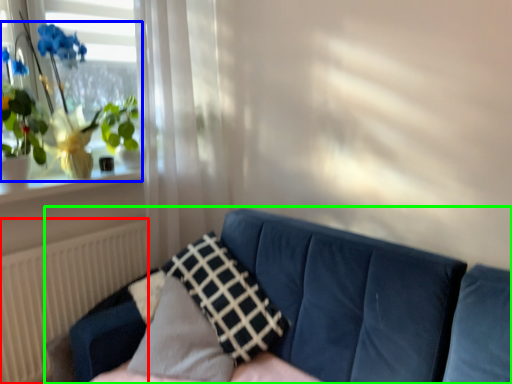
Question: Considering the real-world distances, which object is closest to radiator (highlighted by a red box)? houseplant (highlighted by a blue box) or studio couch (highlighted by a green box).

Choices:
 (A) houseplant
 (B) studio couch

Answer: (A)